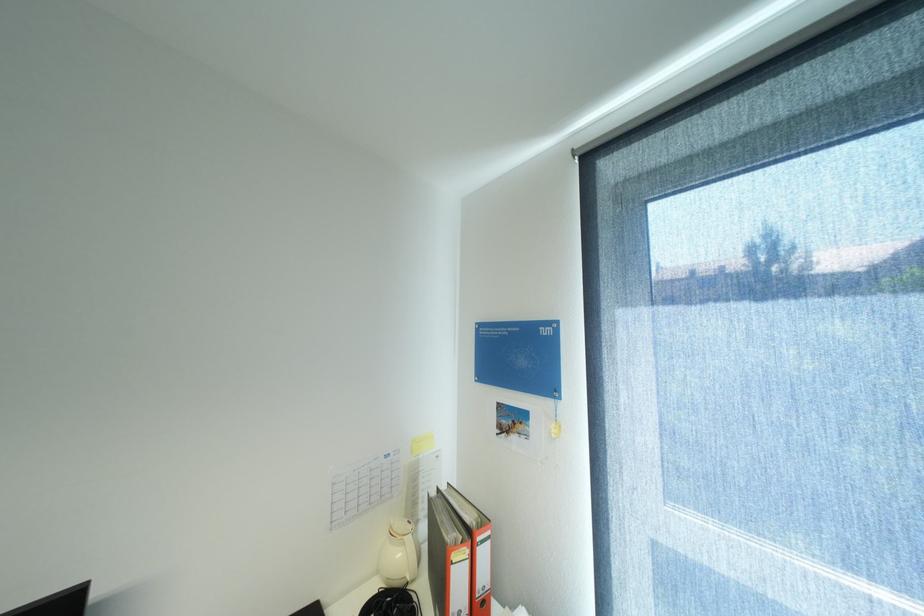
Find the location of a particular element. The height and width of the screenshot is (616, 924). carafe lid is located at coordinates (399, 544).